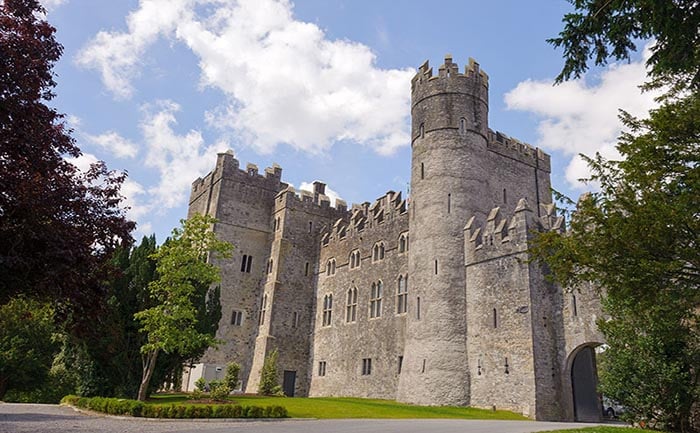
Find the location of `windows`. windows is located at coordinates (362, 365), (323, 369), (323, 316), (354, 305), (385, 301), (398, 299), (402, 243), (378, 247), (360, 255), (332, 262).